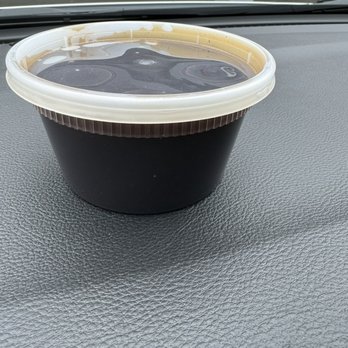
At what (x,y) coordinates should I click in order to perform the action: click on dark liquid in cup. Please return your answer as a coordinate pair (x, y). The height and width of the screenshot is (348, 348). Looking at the image, I should click on (156, 151).